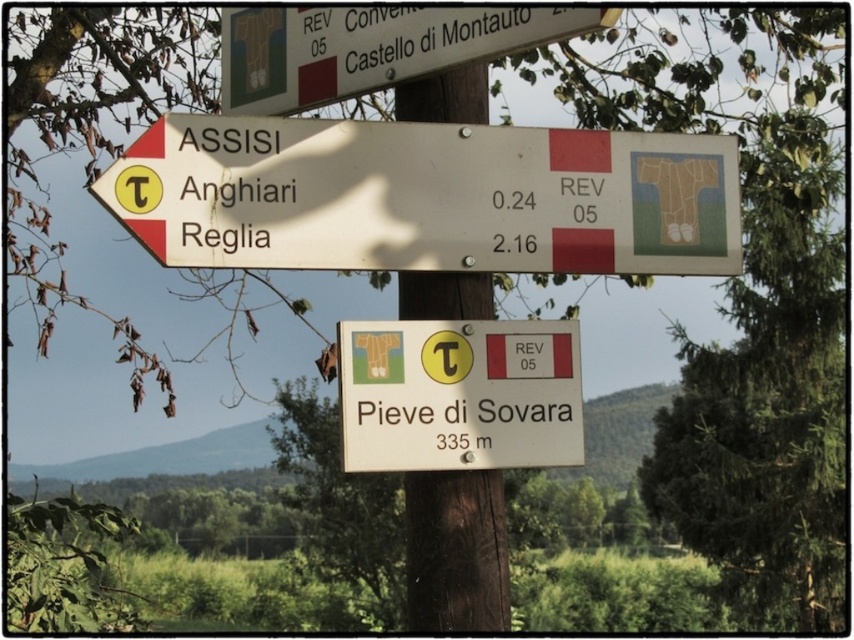
Who is more distant from viewer, (291, 225) or (445, 496)?

The point (445, 496) is more distant.

The height and width of the screenshot is (640, 854). What do you see at coordinates (427, 196) in the screenshot? I see `white matte sign at upper left` at bounding box center [427, 196].

At what (x,y) coordinates should I click in order to perform the action: click on white matte sign at upper left. Please return your answer as a coordinate pair (x, y). The image size is (854, 640). Looking at the image, I should click on (427, 196).

Based on the photo, does white plastic sign at center have a greater width compared to brown wood pole at center?

Yes, white plastic sign at center is wider than brown wood pole at center.

Is white plastic sign at center taller than brown wood pole at center?

No, white plastic sign at center is not taller than brown wood pole at center.

Where is `white plastic sign at center`? white plastic sign at center is located at coordinates (459, 394).

Who is positioned more to the left, white matte sign at upper left or white plastic sign at center?

white matte sign at upper left is more to the left.

Is white matte sign at upper left smaller than white plastic sign at center?

Actually, white matte sign at upper left might be larger than white plastic sign at center.

Where is `white matte sign at upper left`? The height and width of the screenshot is (640, 854). white matte sign at upper left is located at coordinates (427, 196).